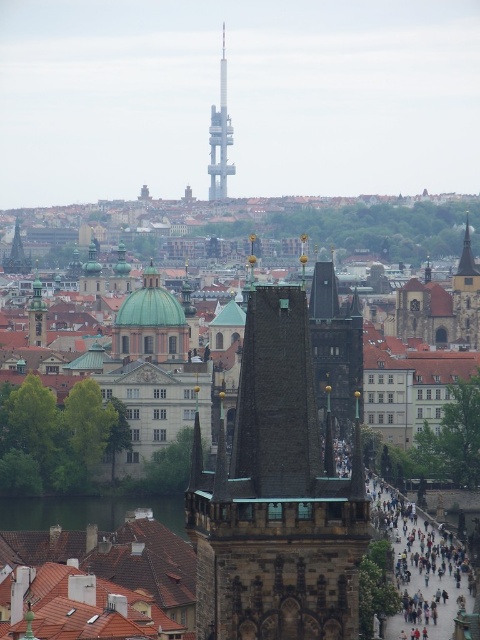
Question: Which of the following is the closest to the observer?

Choices:
 (A) (439, 563)
 (B) (214, 193)
 (C) (354, 448)
 (D) (179, 522)

Answer: (C)

Question: Is dark gray stone tower at center smaller than smooth gray tower at center?

Choices:
 (A) no
 (B) yes

Answer: (A)

Question: Can you confirm if dark gray stone bridge at lower right is positioned below green water at lower left?

Choices:
 (A) no
 (B) yes

Answer: (A)

Question: Which object appears closest to the camera in this image?

Choices:
 (A) dark gray stone bridge at lower right
 (B) dark gray stone tower at center

Answer: (B)

Question: Is dark gray stone tower at center further to camera compared to green water at lower left?

Choices:
 (A) no
 (B) yes

Answer: (A)

Question: Which of the following is the farthest from the observer?

Choices:
 (A) smooth gray tower at center
 (B) green water at lower left
 (C) dark gray stone tower at center

Answer: (A)